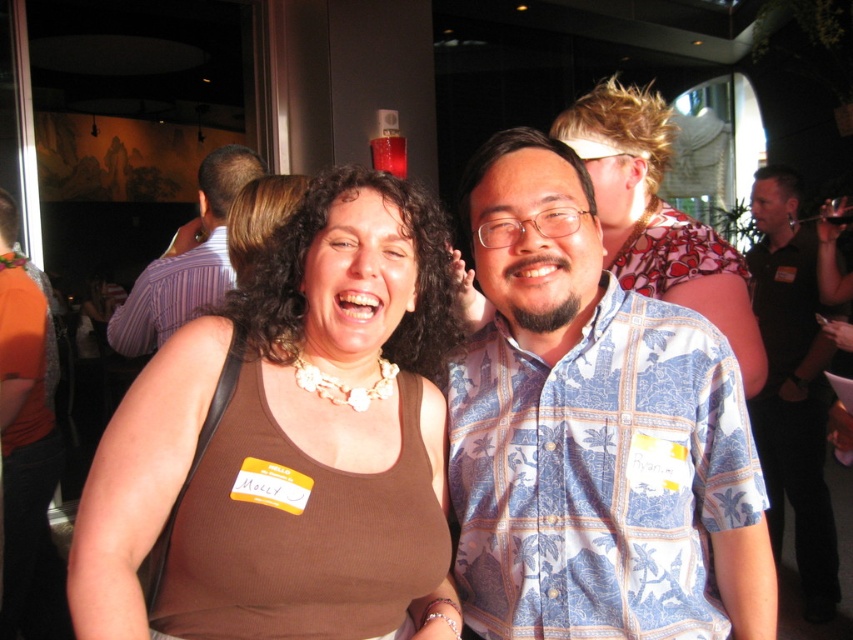
You are a photographer at the event and want to ensure both the brown ribbed tank top at center and the blue patterned shirt at center are visible in your photo. Based on their positions, which one is closer to the camera?

The brown ribbed tank top at center is located above the blue patterned shirt at center, so it is closer to the camera.

You are standing at the center of the room and want to take a photo of the blue printed shirt at center. Which direction should you move to get a clear shot?

Since the blue printed shirt at center is located at point (593, 433), you should move towards the center of the room to get a clear shot.